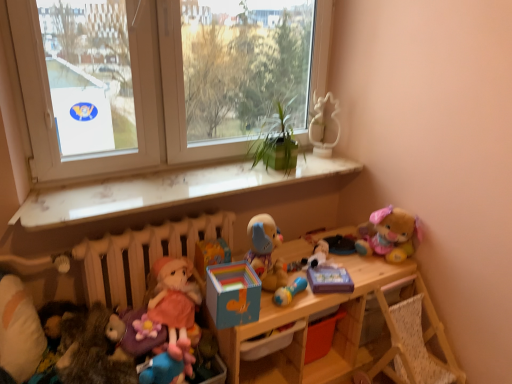
Locate an element on the screen. vacant point above wooden toy box at center (from a real-world perspective) is located at coordinates (315, 258).